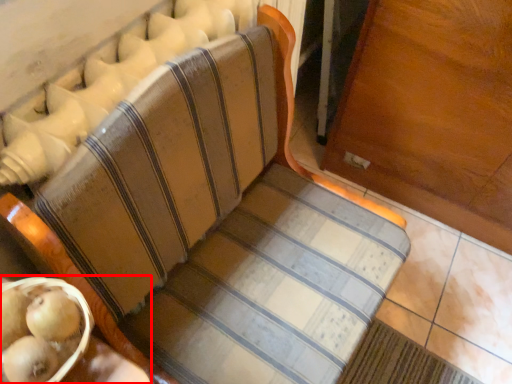
Question: Observing the image, what is the correct spatial positioning of table (annotated by the red box) in reference to fruit?

Choices:
 (A) right
 (B) left

Answer: (B)